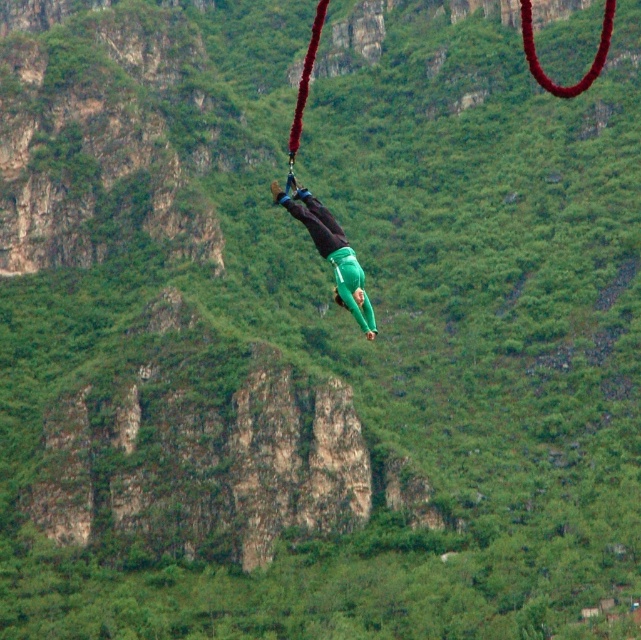
You are a safety inspector checking the bungee jumping setup. The safety protocol requires that the bungee cord must be anchored at least 2 meters above the highest point of the jumper. The green fabric person at center is currently at point 0.397, 0.518. Can you confirm if the anchor point is compliant with safety standards?

The green fabric person at center is at point (331, 253). According to the safety protocol, the anchor point must be at least 2 meters above the highest point of the jumper. However, without knowing the actual height of the jumper or the coordinate system scaling, it is impossible to determine compliance with safety standards based on the provided information.

You are a safety inspector checking the bungee setup. The green fabric person at center is attached to the red fabric rope at center. According to safety standards, the person should be above the rope to ensure proper tension. Is the current setup compliant?

The green fabric person at center is below the red fabric rope at center, which violates safety standards requiring the person to be above the rope for proper tension. The setup is not compliant.